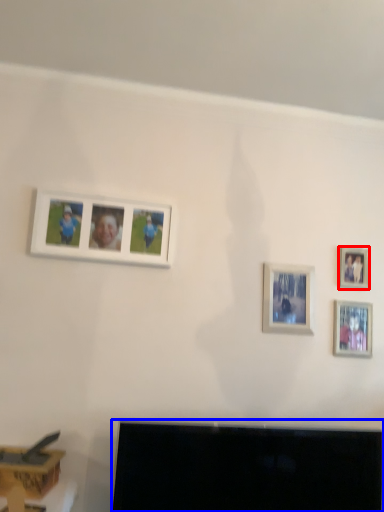
Question: Which object appears closest to the camera in this image, picture frame (highlighted by a red box) or television (highlighted by a blue box)?

Choices:
 (A) picture frame
 (B) television

Answer: (B)